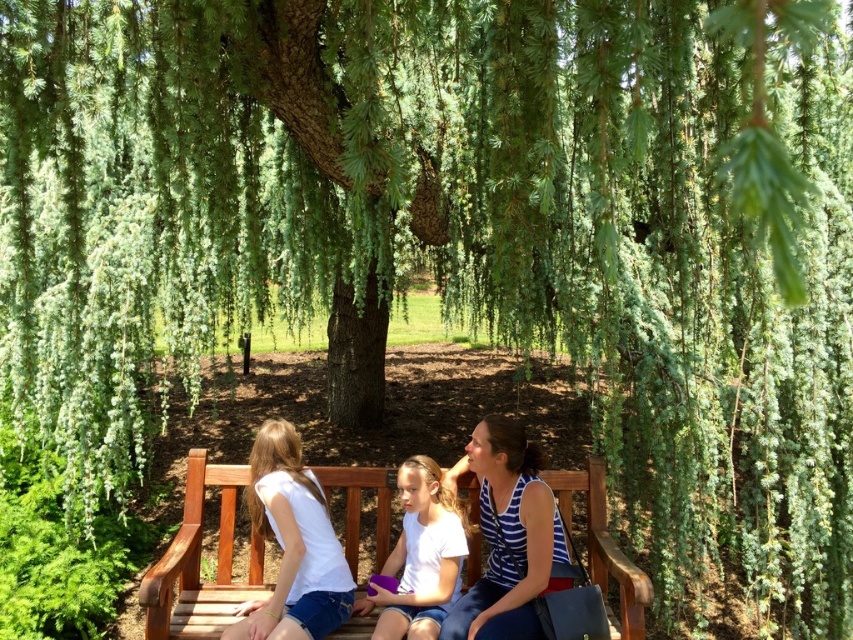
You are standing in front of the bench and want to place a small potted plant between the two points, point (476,492) and point (527,632). Which point should the plant be closer to in order to be closer to the viewer?

The plant should be closer to point (476,492) because it is closer to the viewer than point (527,632).

You are standing in the park and see the wooden bench at center and the striped fabric top at center. Which object is nearer to you?

The wooden bench at center is closer to the viewer than the striped fabric top at center.